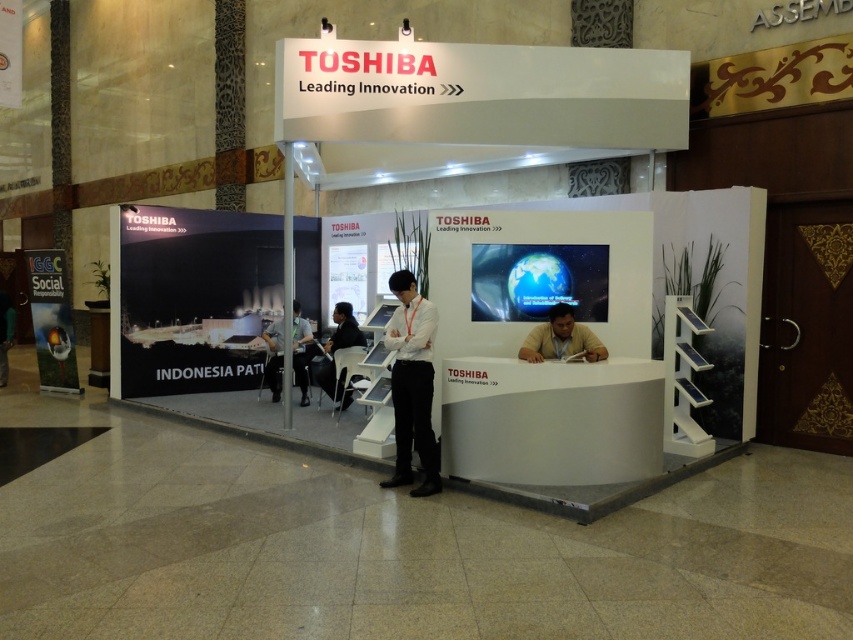
Question: Among these objects, which one is farthest from the camera?

Choices:
 (A) brown leather jacket at center
 (B) black fabric chair at center
 (C) white fabric shirt at center
 (D) white smooth desk at center

Answer: (C)

Question: Considering the real-world distances, which object is farthest from the white shirt at center?

Choices:
 (A) white fabric shirt at center
 (B) brown leather jacket at center

Answer: (A)

Question: Is white shirt at center positioned before white fabric shirt at center?

Choices:
 (A) yes
 (B) no

Answer: (A)

Question: Which point appears closest to the camera in this image?

Choices:
 (A) (341, 344)
 (B) (482, 476)
 (C) (405, 426)

Answer: (B)

Question: Where is brown leather jacket at center located in relation to black fabric chair at center in the image?

Choices:
 (A) right
 (B) left

Answer: (A)

Question: Observing the image, what is the correct spatial positioning of brown leather jacket at center in reference to black fabric chair at center?

Choices:
 (A) left
 (B) right

Answer: (B)